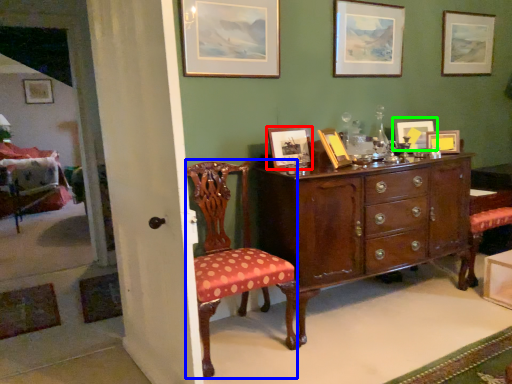
Question: Which object is the farthest from picture frame (highlighted by a red box)? Choose among these: chair (highlighted by a blue box) or picture frame (highlighted by a green box).

Choices:
 (A) chair
 (B) picture frame

Answer: (B)